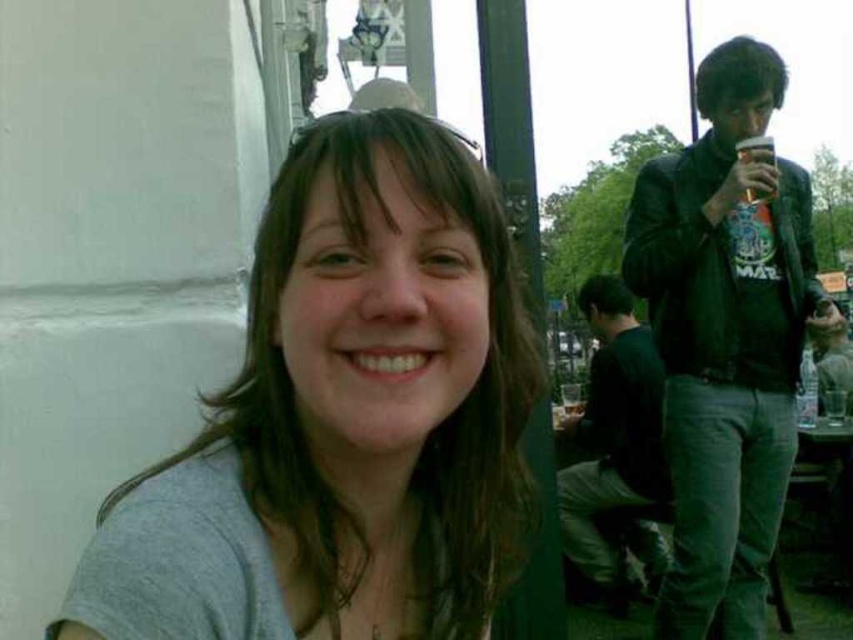
Question: Which point appears closest to the camera in this image?

Choices:
 (A) (746, 147)
 (B) (788, 300)
 (C) (421, 241)

Answer: (C)

Question: Which point appears farthest from the camera in this image?

Choices:
 (A) (740, 148)
 (B) (727, 209)
 (C) (366, 177)

Answer: (A)

Question: Is black leather jacket at upper right below translucent plastic cup at upper right?

Choices:
 (A) no
 (B) yes

Answer: (B)

Question: Does gray matte shirt at center have a lesser width compared to black leather jacket at upper right?

Choices:
 (A) no
 (B) yes

Answer: (B)

Question: Which point appears closest to the camera in this image?

Choices:
 (A) (96, 630)
 (B) (773, 152)

Answer: (A)

Question: Observing the image, what is the correct spatial positioning of gray matte shirt at center in reference to translucent plastic cup at upper right?

Choices:
 (A) above
 (B) below

Answer: (B)